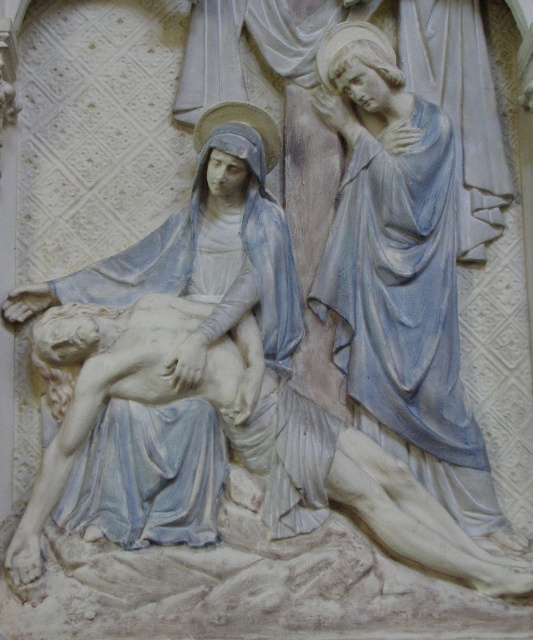
You are an art conservator examining the stone relief sculpture. You need to place a protective barrier around the central area of the relief. The barrier must be placed at the exact center coordinates of the relief. The relief has a coordinate system where the bottom left corner is at point 0,0 and the top right corner is at point 1,1. Given the white marble statue at center is located at point 0.569, 0.325, is the statue positioned to the left or right of the vertical centerline of the relief?

Result: The vertical centerline of the relief is at 0.5 on the x coordinate. The white marble statue at center has an x coordinate of 0.569, which is to the right of the vertical centerline.

Looking at the religious stone relief sculpture, you see a white marble statue at center and a matte stone figure at upper right. Which of these two figures is larger in size?

The white marble statue at center is bigger than the matte stone figure at upper right.